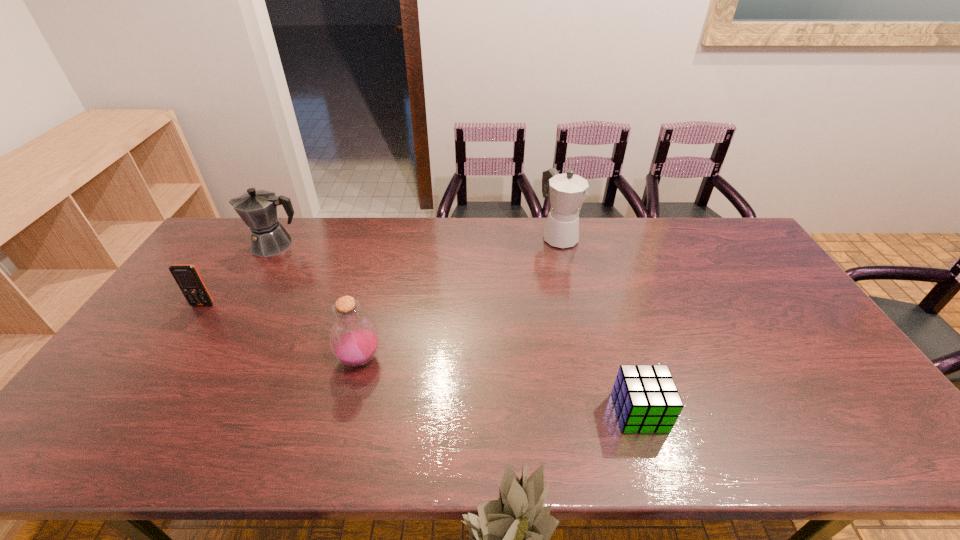
Identify the location of free space that is in between the taller coffeepot and the shorter coffeepot. (417, 241).

This screenshot has width=960, height=540. I want to click on free space between the left coffeepot and the nearest object, so click(x=457, y=329).

Find the location of a particular element. This screenshot has height=540, width=960. vacant area between the third object from right to left and the left coffeepot is located at coordinates (318, 302).

Find the location of a particular element. vacant area between the cube and the taller coffeepot is located at coordinates (599, 325).

Identify which object is located as the second nearest to the third nearest object. Please provide its 2D coordinates. Your answer should be formatted as a tuple, i.e. [(x, y)], where the tuple contains the x and y coordinates of a point satisfying the conditions above.

[(354, 338)]

Identify the location of the closest object to the third object from right to left. (187, 277).

This screenshot has width=960, height=540. In order to click on free spot that satisfies the following two spatial constraints: 1. on the screen of the fourth farthest object; 2. on the left side of the third farthest object in this screenshot , I will do `click(167, 359)`.

Image resolution: width=960 pixels, height=540 pixels. Find the location of `vacant point that satisfies the following two spatial constraints: 1. on the screen of the shortest object; 2. on the right side of the fourth tallest object`. vacant point that satisfies the following two spatial constraints: 1. on the screen of the shortest object; 2. on the right side of the fourth tallest object is located at coordinates (131, 413).

Image resolution: width=960 pixels, height=540 pixels. In order to click on free point that satisfies the following two spatial constraints: 1. on the back side of the cube; 2. at the spout of the left coffeepot in this screenshot , I will do `click(588, 245)`.

In order to click on vacant space that satisfies the following two spatial constraints: 1. on the screen of the shortest object; 2. on the left side of the second shortest object in this screenshot , I will do `click(131, 413)`.